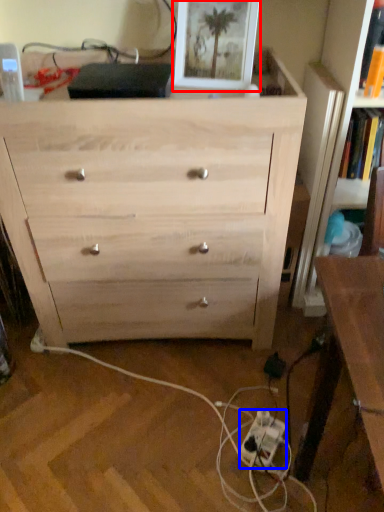
Question: Among these objects, which one is farthest to the camera, picture frame (highlighted by a red box) or extension cord (highlighted by a blue box)?

Choices:
 (A) picture frame
 (B) extension cord

Answer: (B)